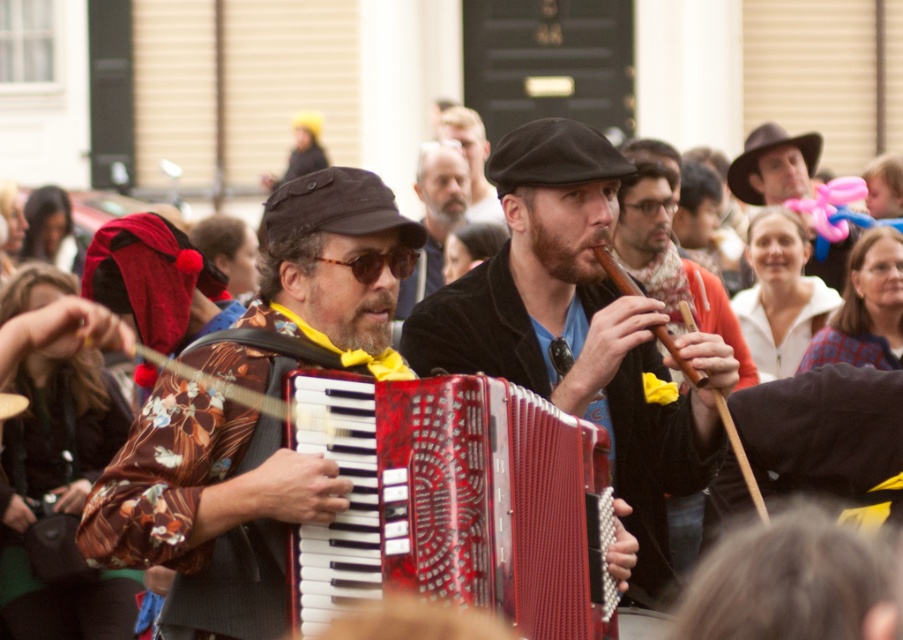
Which is more to the left, shiny red accordion at center or bearded man at center?

bearded man at center is more to the left.

What do you see at coordinates (455, 502) in the screenshot?
I see `shiny red accordion at center` at bounding box center [455, 502].

The image size is (903, 640). Describe the element at coordinates (455, 502) in the screenshot. I see `shiny red accordion at center` at that location.

The width and height of the screenshot is (903, 640). What are the coordinates of `shiny red accordion at center` in the screenshot? It's located at (455, 502).

From the picture: Can you confirm if shiny red accordion at center is positioned to the left of matte black hat at center?

Incorrect, shiny red accordion at center is not on the left side of matte black hat at center.

Between point (308, 570) and point (457, 138), which one is positioned behind?

The point (457, 138) is behind.

At what (x,y) coordinates should I click in order to perform the action: click on shiny red accordion at center. Please return your answer as a coordinate pair (x, y). The image size is (903, 640). Looking at the image, I should click on (455, 502).

The width and height of the screenshot is (903, 640). Find the location of `shiny red accordion at center`. shiny red accordion at center is located at coordinates (455, 502).

Which of these two, shiny red accordion at center or matte black accordion at center, stands taller?

With more height is matte black accordion at center.

Is point (399, 548) positioned after point (667, 586)?

That is False.

Locate an element on the screen. The height and width of the screenshot is (640, 903). shiny red accordion at center is located at coordinates (455, 502).